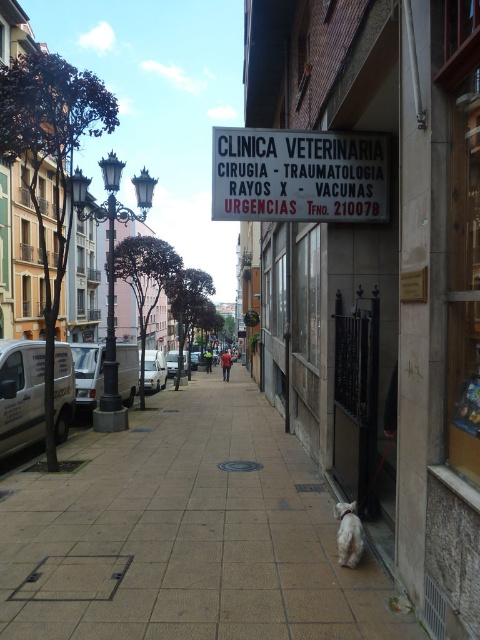
Question: From the image, what is the correct spatial relationship of white paper sign at center in relation to silver metallic van at center?

Choices:
 (A) left
 (B) right

Answer: (B)

Question: Is brown tile pavement at center further to camera compared to white matte van at left?

Choices:
 (A) yes
 (B) no

Answer: (B)

Question: Which point is farther from the camera taking this photo?

Choices:
 (A) (343, 524)
 (B) (95, 372)
 (C) (153, 371)
 (D) (22, 435)

Answer: (C)

Question: Which point appears closest to the camera in this image?

Choices:
 (A) (84, 387)
 (B) (239, 397)

Answer: (A)

Question: Does white matte van at left have a smaller size compared to white matte van at center?

Choices:
 (A) no
 (B) yes

Answer: (B)

Question: Which point is closer to the camera?

Choices:
 (A) white paper sign at center
 (B) white matte van at left
 (C) brown tile pavement at center

Answer: (C)